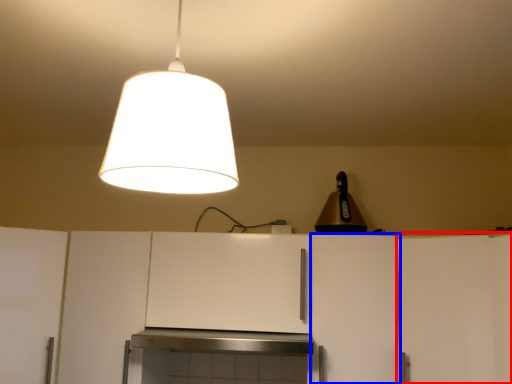
Question: Among these objects, which one is farthest to the camera, cabinetry (highlighted by a red box) or cabinetry (highlighted by a blue box)?

Choices:
 (A) cabinetry
 (B) cabinetry

Answer: (B)